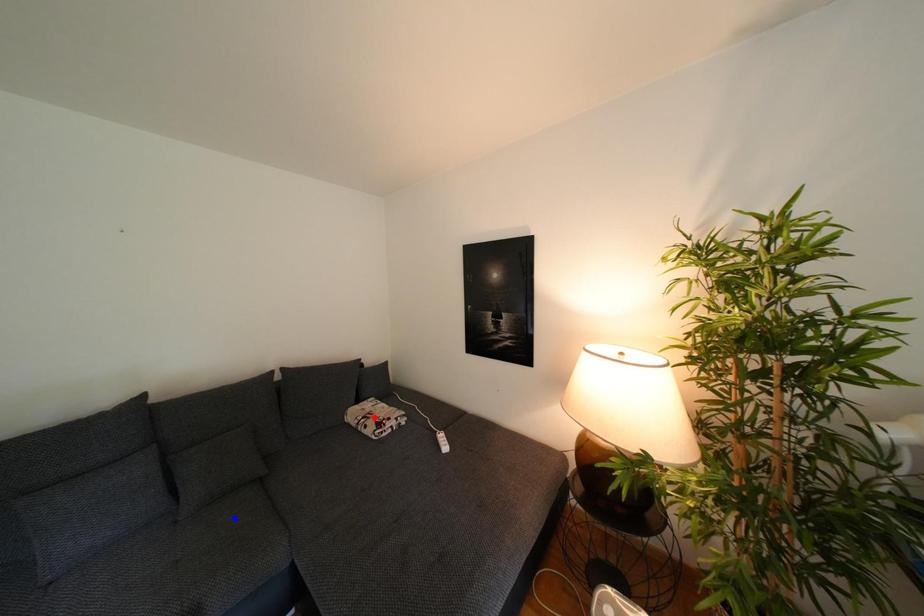
Question: Which of the two points in the image is closer to the camera?

Choices:
 (A) Blue point is closer.
 (B) Red point is closer.

Answer: (A)